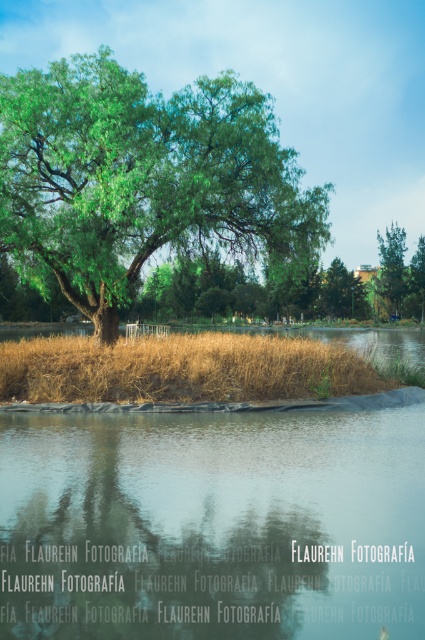
Where is `transparent glass water at lower center`? The height and width of the screenshot is (640, 425). transparent glass water at lower center is located at coordinates (214, 524).

This screenshot has height=640, width=425. What do you see at coordinates (214, 524) in the screenshot?
I see `transparent glass water at lower center` at bounding box center [214, 524].

Which is in front, point (410, 557) or point (388, 248)?

Point (410, 557) is more forward.

I want to click on transparent glass water at lower center, so click(x=214, y=524).

Can you confirm if green leafy tree at center is positioned above dry grass at center?

Indeed, green leafy tree at center is positioned over dry grass at center.

Does point (138, 104) lie behind point (56, 369)?

Yes, it is.

Identify the location of green leafy tree at center. The image size is (425, 640). (141, 177).

The image size is (425, 640). What do you see at coordinates (214, 524) in the screenshot? I see `transparent glass water at lower center` at bounding box center [214, 524].

The width and height of the screenshot is (425, 640). Describe the element at coordinates (214, 524) in the screenshot. I see `transparent glass water at lower center` at that location.

Locate an element on the screen. transparent glass water at lower center is located at coordinates (214, 524).